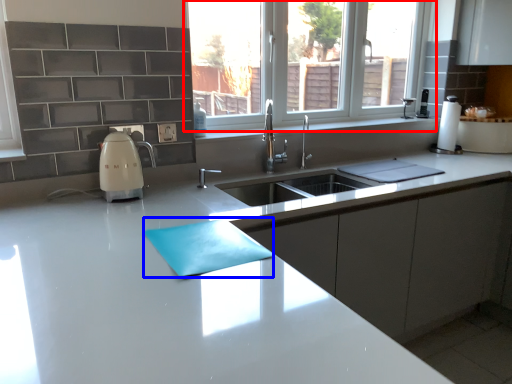
Question: Which object is further to the camera taking this photo, window (highlighted by a red box) or place mat (highlighted by a blue box)?

Choices:
 (A) window
 (B) place mat

Answer: (A)